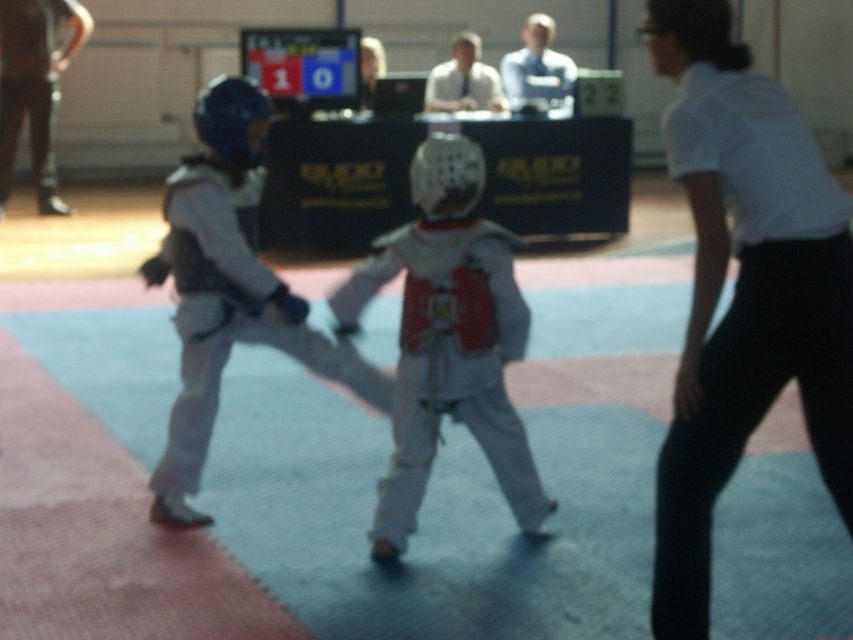
Does white matte helmet at center appear on the left side of white matte karate uniform at center?

No, white matte helmet at center is not to the left of white matte karate uniform at center.

Looking at this image, can you confirm if white matte helmet at center is wider than white matte karate uniform at center?

Incorrect, white matte helmet at center's width does not surpass white matte karate uniform at center's.

The height and width of the screenshot is (640, 853). In order to click on white matte helmet at center in this screenshot , I will do `click(448, 339)`.

Find the location of a particular element. The image size is (853, 640). white matte helmet at center is located at coordinates (448, 339).